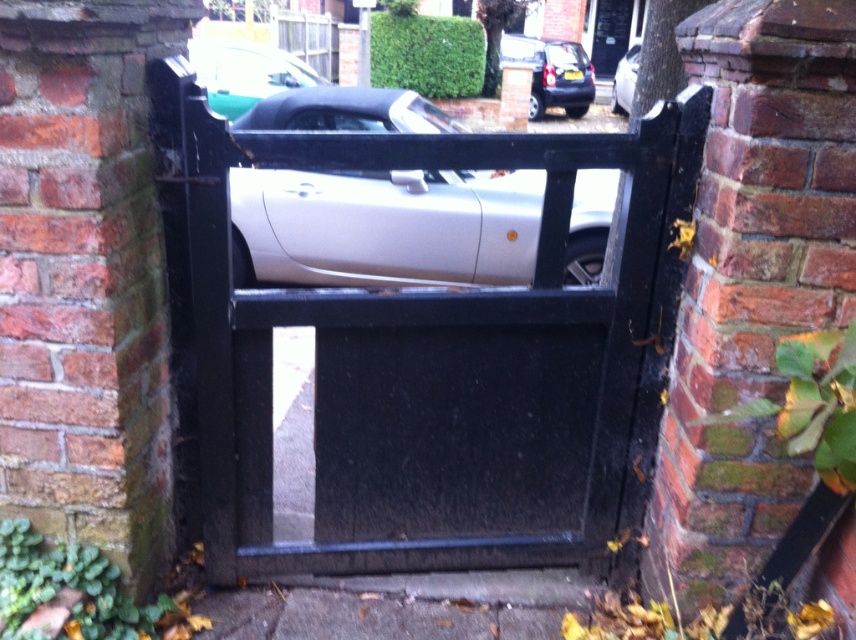
Between silver metallic car at center and satin silver car at center, which one is positioned higher?

satin silver car at center is above.

Which is in front, point (522, 180) or point (617, 109)?

Point (522, 180) is in front.

Find the location of a particular element. Image resolution: width=856 pixels, height=640 pixels. silver metallic car at center is located at coordinates (385, 227).

Is black glossy car at upper center bigger than satin silver car at center?

Yes, black glossy car at upper center is bigger than satin silver car at center.

Does black glossy car at upper center have a lesser width compared to satin silver car at center?

Incorrect, black glossy car at upper center's width is not less than satin silver car at center's.

Which is in front, point (569, 84) or point (613, 86)?

Point (569, 84) is more forward.

Identify the location of black glossy car at upper center. The height and width of the screenshot is (640, 856). (553, 74).

Who is higher up, green metallic car at upper center or black glossy car at upper center?

black glossy car at upper center

Is point (224, 96) positioned in front of point (590, 83)?

Yes, point (224, 96) is in front of point (590, 83).

Image resolution: width=856 pixels, height=640 pixels. I want to click on green metallic car at upper center, so click(245, 72).